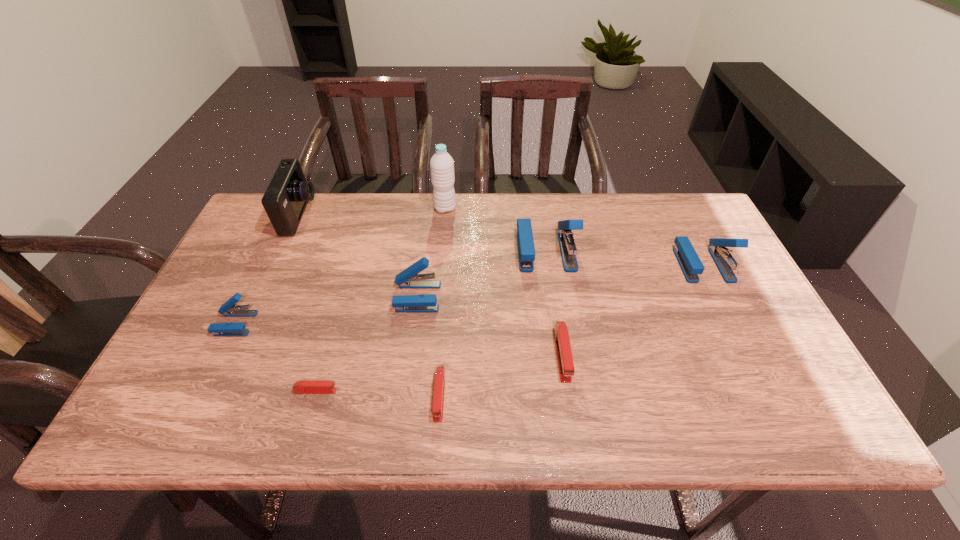
Identify which stapler is the second nearest to the third blue stapler from right to left. Please provide its 2D coordinates. Your answer should be formatted as a tuple, i.e. [(x, y)], where the tuple contains the x and y coordinates of a point satisfying the conditions above.

[(526, 251)]

Choose which blue stapler is the nearest neighbor to the second smallest red stapler. Please provide its 2D coordinates. Your answer should be formatted as a tuple, i.e. [(x, y)], where the tuple contains the x and y coordinates of a point satisfying the conditions above.

[(409, 278)]

This screenshot has height=540, width=960. Find the location of `the third closest blue stapler to the shortest stapler`. the third closest blue stapler to the shortest stapler is located at coordinates (526, 251).

Locate an element on the screen. red stapler that is the third closest one to the second smallest blue stapler is located at coordinates (562, 342).

You are a GUI agent. You are given a task and a screenshot of the screen. Output one action in this format:
    pyautogui.click(x=<x>, y=<y>)
    Task: Click on the red stapler that is the second closest to the third shortest object
    This screenshot has height=540, width=960.
    Given the screenshot: What is the action you would take?
    pyautogui.click(x=302, y=387)

The height and width of the screenshot is (540, 960). What are the coordinates of `free location that satisfies the following two spatial constraints: 1. on the front-facing side of the blue camera; 2. on the back side of the biggest blue stapler` in the screenshot? It's located at (284, 251).

Find the location of a particular element. Image resolution: width=960 pixels, height=540 pixels. vacant area that satisfies the following two spatial constraints: 1. on the back side of the sixth shortest stapler; 2. on the front-facing side of the camera is located at coordinates (679, 216).

Find the location of `vacant space that satisfies the following two spatial constraints: 1. on the back side of the fifth shortest stapler; 2. on the front-facing side of the camera`. vacant space that satisfies the following two spatial constraints: 1. on the back side of the fifth shortest stapler; 2. on the front-facing side of the camera is located at coordinates (428, 216).

Find the location of a particular element. free space that satisfies the following two spatial constraints: 1. on the front side of the rightmost object; 2. on the front-facing side of the shortest object is located at coordinates (766, 391).

Where is `free space in the image that satisfies the following two spatial constraints: 1. on the front-facing side of the blue camera; 2. on the back side of the third stapler from left to right`? The image size is (960, 540). free space in the image that satisfies the following two spatial constraints: 1. on the front-facing side of the blue camera; 2. on the back side of the third stapler from left to right is located at coordinates pyautogui.click(x=264, y=296).